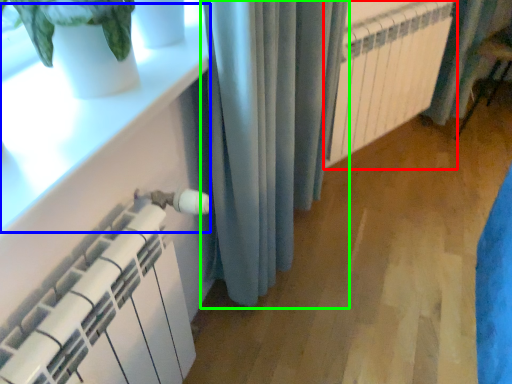
Question: Which is nearer to the radiator (highlighted by a red box)? window sill (highlighted by a blue box) or curtain (highlighted by a green box).

Choices:
 (A) window sill
 (B) curtain

Answer: (B)